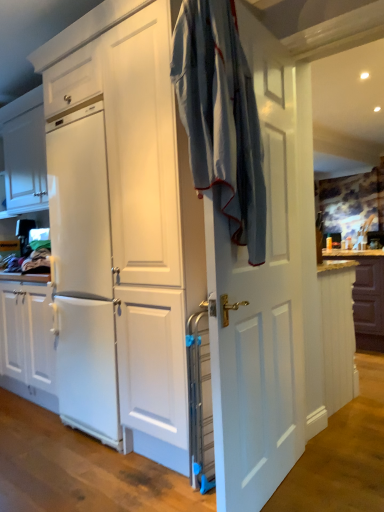
Image resolution: width=384 pixels, height=512 pixels. In order to click on vacant area that lies to the right of white matte door at center in this screenshot , I will do `click(330, 490)`.